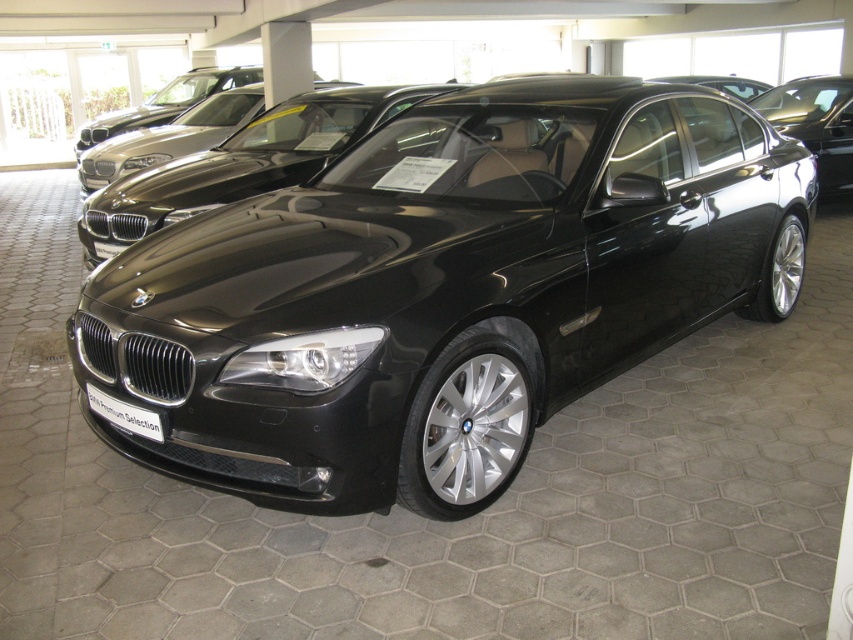
You are a photographer setting up a shot of the satin black sedan at center and the black metallic license plate at center. You want to ensure both are in focus. Since the sedan is above the license plate, where should you position your camera to capture both effectively?

The satin black sedan at center is above the black metallic license plate at center. To capture both in focus, position the camera at eye level with the sedan and slightly angled downward to include the license plate in the frame.

Based on the photo, you are a car salesman who wants to highlight the differences between the shiny black car at center and the satin black sedan at center. Which car is taller?

The shiny black car at center is taller than the satin black sedan at center.